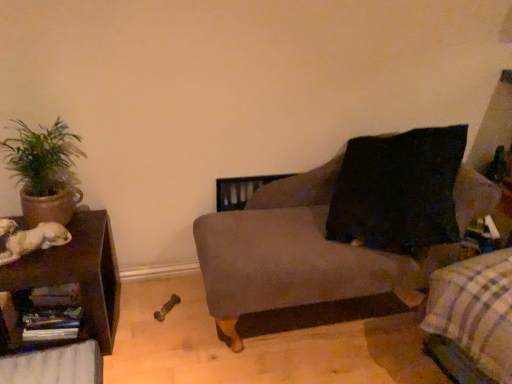
This screenshot has width=512, height=384. I want to click on free spot below white fur dog at left (from a real-world perspective), so click(x=27, y=251).